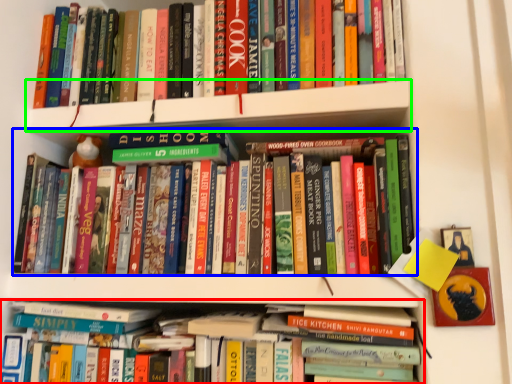
Question: Based on their relative distances, which object is farther from book (highlighted by a red box)? Choose from book (highlighted by a blue box) and shelf (highlighted by a green box).

Choices:
 (A) book
 (B) shelf

Answer: (B)